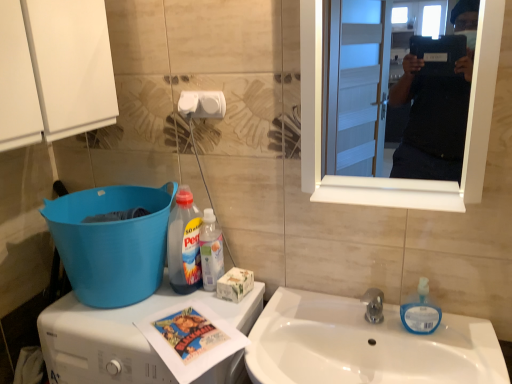
Identify the location of translucent plastic detergent at lower left, placed as the 2th bottle when sorted from right to left. Image resolution: width=512 pixels, height=384 pixels. (184, 244).

Where is `white matte toilet paper at upper center`? The image size is (512, 384). white matte toilet paper at upper center is located at coordinates (202, 104).

What do you see at coordinates (54, 70) in the screenshot? Image resolution: width=512 pixels, height=384 pixels. I see `white glossy cabinet at upper left` at bounding box center [54, 70].

Where is `translucent plastic bottle at center, acting as the 1th bottle starting from the right`? translucent plastic bottle at center, acting as the 1th bottle starting from the right is located at coordinates point(211,251).

In the scene shown: What is the approximate height of blue plastic bucket at lower left?

12.92 inches.

You are a GUI agent. You are given a task and a screenshot of the screen. Output one action in this format:
    pyautogui.click(x=<x>, y=<y>)
    Task: Click on the blue translucent soap dispenser at sink right
    This screenshot has width=512, height=384.
    Given the screenshot: What is the action you would take?
    pyautogui.click(x=421, y=312)

This screenshot has height=384, width=512. I want to click on translucent plastic detergent at lower left, placed as the 2th bottle when sorted from right to left, so click(184, 244).

Between white glossy cabinet at upper left and white cardboard box at lower center, which one appears on the right side from the viewer's perspective?

From the viewer's perspective, white cardboard box at lower center appears more on the right side.

Is point (52, 109) closer or farther from the camera than point (224, 292)?

Point (52, 109) appears to be closer to the viewer than point (224, 292).

Considering the relative sizes of white glossy cabinet at upper left and white cardboard box at lower center in the image provided, is white glossy cabinet at upper left bigger than white cardboard box at lower center?

Indeed, white glossy cabinet at upper left has a larger size compared to white cardboard box at lower center.

Is white glossy cabinet at upper left oriented towards white cardboard box at lower center?

No.

From a real-world perspective, which is physically below, white glossy mirror at upper right or printed paper magazine at lower left?

In real-world perspective, printed paper magazine at lower left is lower.

Looking at this image, which point is more distant from viewer, (x=443, y=135) or (x=210, y=358)?

Positioned behind is point (x=443, y=135).

Is printed paper magazine at lower left surrounded by white glossy mirror at upper right?

No, white glossy mirror at upper right does not contain printed paper magazine at lower left.

Is white glossy mirror at upper right at the right side of printed paper magazine at lower left?

Yes, white glossy mirror at upper right is to the right of printed paper magazine at lower left.

Would you say blue translucent soap dispenser at sink right is inside or outside white matte toilet paper at upper center?

blue translucent soap dispenser at sink right is located beyond the bounds of white matte toilet paper at upper center.

What's the angular difference between blue translucent soap dispenser at sink right and white matte toilet paper at upper center's facing directions?

0.856 degrees separate the facing orientations of blue translucent soap dispenser at sink right and white matte toilet paper at upper center.

Who is bigger, blue translucent soap dispenser at sink right or white matte toilet paper at upper center?

Bigger between the two is blue translucent soap dispenser at sink right.

The image size is (512, 384). In the image, there is a white matte toilet paper at upper center. What are the coordinates of `toiletries below it (from a real-world perspective)` in the screenshot? It's located at (421, 312).

From the picture: Is translucent plastic bottle at center, acting as the 1th bottle starting from the right, looking in the opposite direction of blue plastic bucket at lower left?

No, blue plastic bucket at lower left is not at the back of translucent plastic bottle at center, acting as the 1th bottle starting from the right.

Is blue plastic bucket at lower left completely or partially inside translucent plastic bottle at center, acting as the 1th bottle starting from the right?

No, blue plastic bucket at lower left is not a part of translucent plastic bottle at center, acting as the 1th bottle starting from the right.

Considering the sizes of translucent plastic bottle at center, acting as the 1th bottle starting from the right, and blue plastic bucket at lower left in the image, is translucent plastic bottle at center, acting as the 1th bottle starting from the right, wider or thinner than blue plastic bucket at lower left?

Clearly, translucent plastic bottle at center, acting as the 1th bottle starting from the right, has less width compared to blue plastic bucket at lower left.

How distant is blue plastic bucket at lower left from white glossy sink at lower center?

The distance of blue plastic bucket at lower left from white glossy sink at lower center is 22.90 inches.

Is white glossy sink at lower center at the back of blue plastic bucket at lower left?

No, blue plastic bucket at lower left's orientation is not away from white glossy sink at lower center.

Is blue plastic bucket at lower left positioned beyond the bounds of white glossy sink at lower center?

Yes, blue plastic bucket at lower left is not within white glossy sink at lower center.

Looking at their sizes, would you say blue plastic bucket at lower left is wider or thinner than white glossy sink at lower center?

Clearly, blue plastic bucket at lower left has less width compared to white glossy sink at lower center.

Is white glossy sink at lower center further to the viewer compared to white plastic washing machine at lower left?

No, white glossy sink at lower center is in front of white plastic washing machine at lower left.

The width and height of the screenshot is (512, 384). I want to click on sink in front of the white plastic washing machine at lower left, so click(365, 345).

Is white glossy sink at lower center outside of white plastic washing machine at lower left?

Yes, white glossy sink at lower center is located beyond the bounds of white plastic washing machine at lower left.

From the image's perspective, does translucent plastic detergent at lower left, positioned as the first bottle in left-to-right order, appear lower than white matte toilet paper at upper center?

Yes.

Can you confirm if translucent plastic detergent at lower left, placed as the 2th bottle when sorted from right to left, is shorter than white matte toilet paper at upper center?

Incorrect, the height of translucent plastic detergent at lower left, placed as the 2th bottle when sorted from right to left, does not fall short of that of white matte toilet paper at upper center.

Between translucent plastic detergent at lower left, positioned as the first bottle in left-to-right order, and white matte toilet paper at upper center, which one is positioned behind?

translucent plastic detergent at lower left, positioned as the first bottle in left-to-right order, is behind.

Where is `box below the white glossy cabinet at upper left (from a real-world perspective)`? box below the white glossy cabinet at upper left (from a real-world perspective) is located at coordinates (234, 284).

At what (x,y) coordinates should I click in order to perform the action: click on magazine below the white glossy mirror at upper right (from the image's perspective). Please return your answer as a coordinate pair (x, y). Looking at the image, I should click on (191, 338).

Based on their spatial positions, is white matte toilet paper at upper center or white plastic washing machine at lower left further from printed paper magazine at lower left?

white matte toilet paper at upper center is further to printed paper magazine at lower left.

When comparing their distances from white glossy cabinet at upper left, does white cardboard box at lower center or white glossy sink at lower center seem further?

white glossy sink at lower center is positioned further to the anchor white glossy cabinet at upper left.

Based on their spatial positions, is blue plastic bucket at lower left or white glossy sink at lower center further from white glossy cabinet at upper left?

white glossy sink at lower center.

Which object lies further to the anchor point white matte toilet paper at upper center, white glossy sink at lower center or blue translucent soap dispenser at sink right?

blue translucent soap dispenser at sink right is further to white matte toilet paper at upper center.

Considering their positions, is printed paper magazine at lower left positioned closer to white plastic washing machine at lower left than translucent plastic bottle at center, which appears as the 2th bottle when viewed from the left?

printed paper magazine at lower left.

Estimate the real-world distances between objects in this image. Which object is closer to white glossy mirror at upper right, translucent plastic bottle at center, acting as the 1th bottle starting from the right, or white plastic washing machine at lower left?

The object closer to white glossy mirror at upper right is translucent plastic bottle at center, acting as the 1th bottle starting from the right.

Based on their spatial positions, is white cardboard box at lower center or blue translucent soap dispenser at sink right further from white plastic washing machine at lower left?

Based on the image, blue translucent soap dispenser at sink right appears to be further to white plastic washing machine at lower left.

Looking at the image, which one is located further to printed paper magazine at lower left, white plastic washing machine at lower left or white cardboard box at lower center?

white cardboard box at lower center.

Identify the location of trash bin/can between white glossy cabinet at upper left and white glossy mirror at upper right. The width and height of the screenshot is (512, 384). (112, 242).

Find the location of `mirror between white matte toilet paper at upper center and white cardboard box at lower center in the vertical direction`. mirror between white matte toilet paper at upper center and white cardboard box at lower center in the vertical direction is located at coordinates (435, 110).

This screenshot has height=384, width=512. I want to click on trash bin/can between white glossy cabinet at upper left and white cardboard box at lower center in the up-down direction, so click(112, 242).

Find the location of a particular element. bottle between blue plastic bucket at lower left and white plastic washing machine at lower left in the vertical direction is located at coordinates [211, 251].